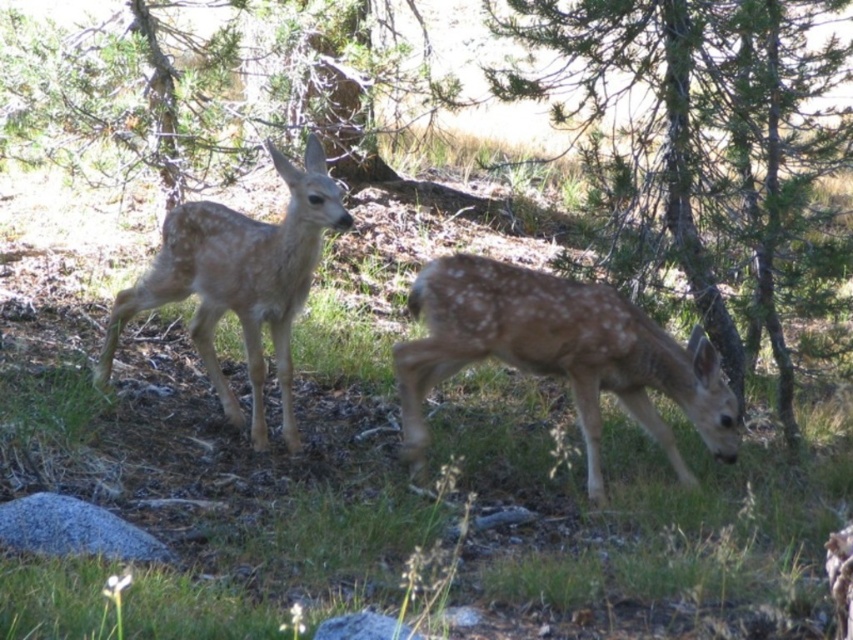
You are a hiker in the forest and want to take a photo of the fawn fur fawn at center. There is a green textured tree at center right blocking the view. Can you move to the left to get a clear shot without the tree in the frame?

The green textured tree at center right is above the fawn fur fawn at center, so moving to the left might still leave the tree partially blocking the view. You might need to adjust your angle or move further away to ensure the tree isn

You are a hiker who wants to take a photo of the green textured tree at center right. If your camera has a maximum focus range of 5 meters, will you be able to capture the tree clearly from your current position?

The green textured tree at center right is 4.50 meters away from the viewer. Since your camera can focus up to 5 meters, you can capture the tree clearly from your current position.